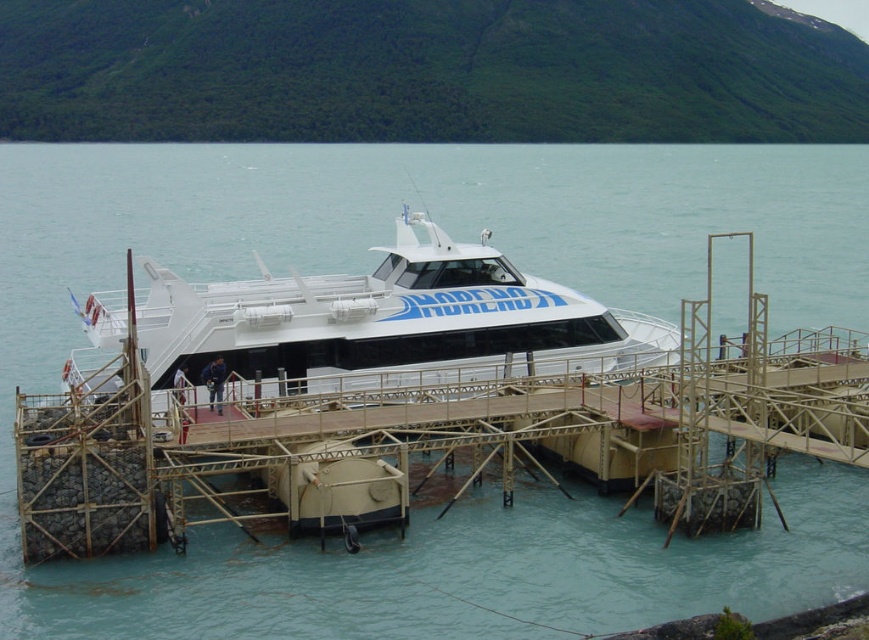
Is wooden dock at center further to camera compared to white glossy cruise ship at center?

No, wooden dock at center is in front of white glossy cruise ship at center.

Is wooden dock at center above white glossy cruise ship at center?

No, wooden dock at center is not above white glossy cruise ship at center.

The height and width of the screenshot is (640, 869). Identify the location of wooden dock at center. (425, 440).

I want to click on wooden dock at center, so click(425, 440).